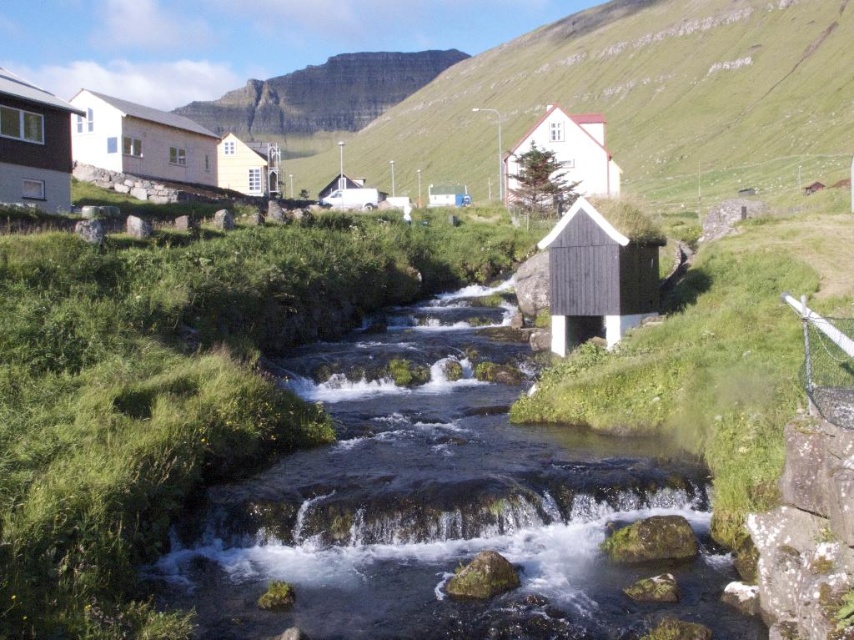
You are standing at the origin point in the image. Where is the clear water at center located in terms of 2D coordinates?

The clear water at center is located at the 2D coordinates of point [437,508].

You are standing at the edge of the stream and want to walk towards the green grassy hillside at upper center. Which direction should you head relative to the clear water at center?

You should head to the right of the clear water at center to reach the green grassy hillside at upper center because the clear water at center is to the left of the green grassy hillside at upper center.

You are a hiker trying to cross the stream. You see the clear water at center and the green grassy hillside at upper center. Which path would be narrower to walk on?

The clear water at center is thinner than the green grassy hillside at upper center, so the clear water at center would be narrower to walk on.